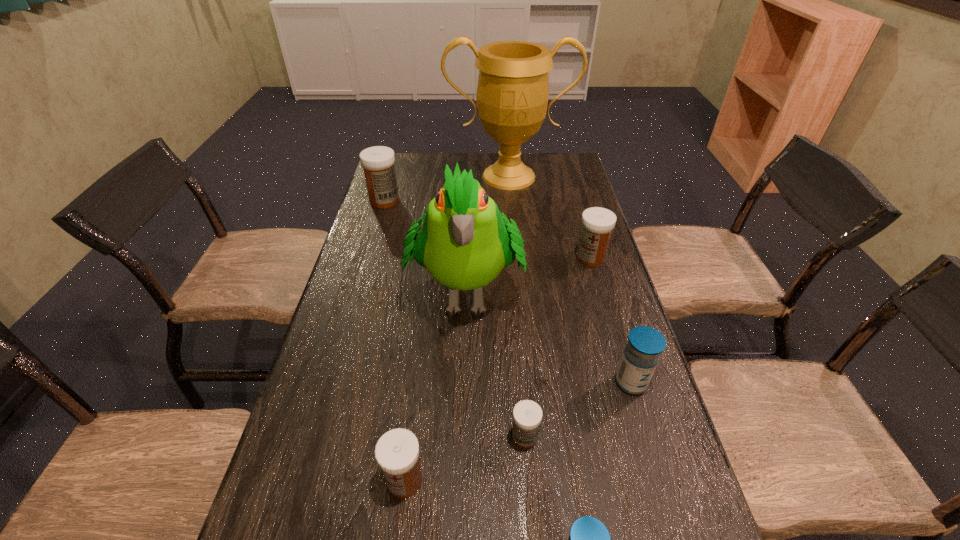
Find the location of a particular element. vacant region between the trophy and the second white medicine from left to right is located at coordinates (457, 328).

This screenshot has height=540, width=960. In order to click on empty location between the trophy and the fourth nearest medicine in this screenshot , I will do `click(570, 280)`.

Where is `unoccupied position between the smallest white medicine and the trophy`? The image size is (960, 540). unoccupied position between the smallest white medicine and the trophy is located at coordinates (516, 307).

I want to click on object that ranks as the third closest to the bigger blue medicine, so click(589, 539).

At what (x,y) coordinates should I click in order to perform the action: click on object identified as the second closest to the rightmost white medicine. Please return your answer as a coordinate pair (x, y). The image size is (960, 540). Looking at the image, I should click on (512, 95).

Locate an element on the screen. the second closest medicine to the trophy is located at coordinates (597, 223).

Point out which medicine is positioned as the second nearest to the fourth nearest medicine. Please provide its 2D coordinates. Your answer should be formatted as a tuple, i.e. [(x, y)], where the tuple contains the x and y coordinates of a point satisfying the conditions above.

[(589, 539)]

Identify which white medicine is the second nearest to the nearer blue medicine. Please provide its 2D coordinates. Your answer should be formatted as a tuple, i.e. [(x, y)], where the tuple contains the x and y coordinates of a point satisfying the conditions above.

[(397, 451)]

Select which white medicine is the third closest to the right blue medicine. Please provide its 2D coordinates. Your answer should be formatted as a tuple, i.e. [(x, y)], where the tuple contains the x and y coordinates of a point satisfying the conditions above.

[(397, 451)]

The height and width of the screenshot is (540, 960). In order to click on blank area in the image that satisfies the following two spatial constraints: 1. on the back side of the nearest white medicine; 2. on the right side of the third nearest medicine in this screenshot , I will do `click(410, 437)`.